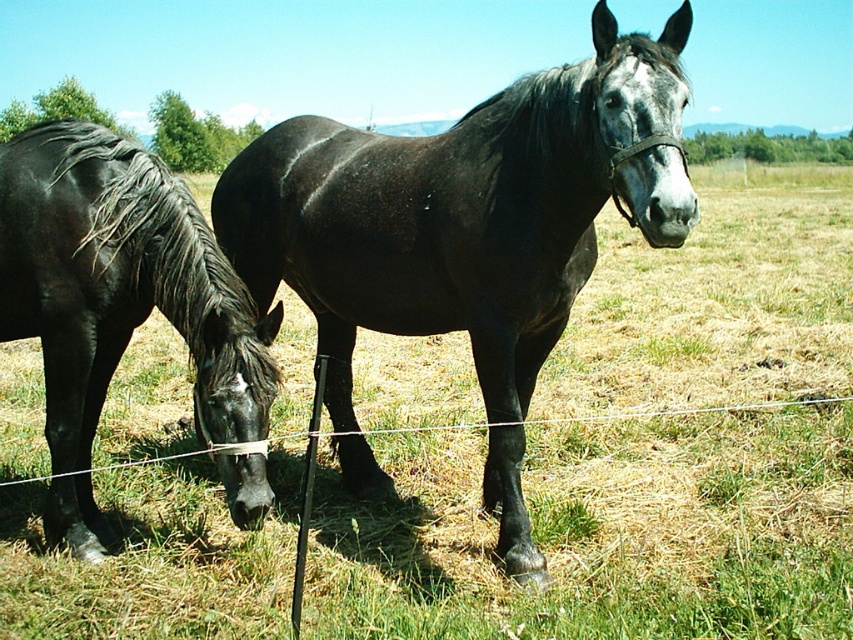
Based on the photo, you are a farmer checking the space in your barn. You see the shiny black horse at center and the black glossy horse at left. Which horse requires more horizontal space to fit into the barn aisle?

The shiny black horse at center requires more horizontal space to fit into the barn aisle because it is wider than the black glossy horse at left according to the description.

You are a farmer checking the field. You notice two horses in the field. Which horse, the shiny black horse at center or the black glossy horse at left, is larger?

The shiny black horse at center is bigger than the black glossy horse at left.